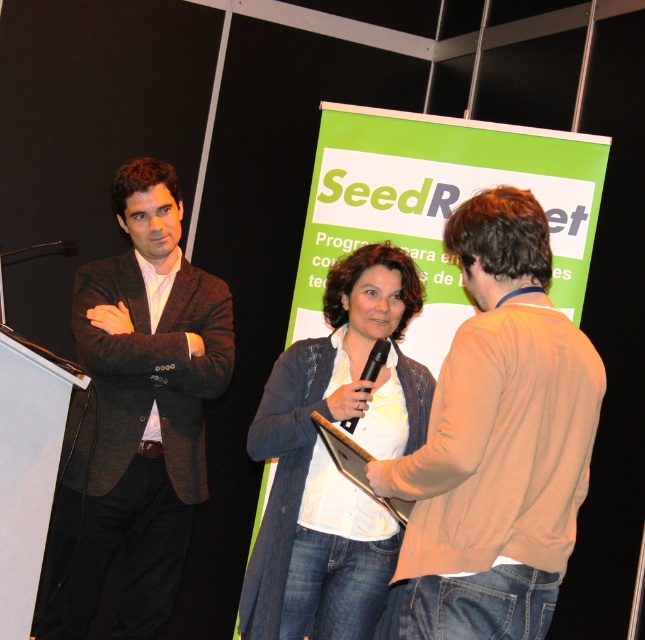
Question: Can you confirm if beige sweater at center is bigger than black plastic microphone at center?

Choices:
 (A) no
 (B) yes

Answer: (B)

Question: Is dark gray suit at left positioned in front of black plastic microphone at center?

Choices:
 (A) yes
 (B) no

Answer: (B)

Question: Which of these objects is positioned closest to the white knitwear at center?

Choices:
 (A) dark gray suit at left
 (B) black plastic microphone at center

Answer: (B)

Question: Is beige sweater at center in front of dark gray suit at left?

Choices:
 (A) no
 (B) yes

Answer: (B)

Question: Which point is farther from the camera taking this photo?

Choices:
 (A) (448, 528)
 (B) (388, 346)

Answer: (B)

Question: Which object appears farthest from the camera in this image?

Choices:
 (A) white knitwear at center
 (B) dark gray suit at left
 (C) beige sweater at center
 (D) black plastic microphone at center

Answer: (B)